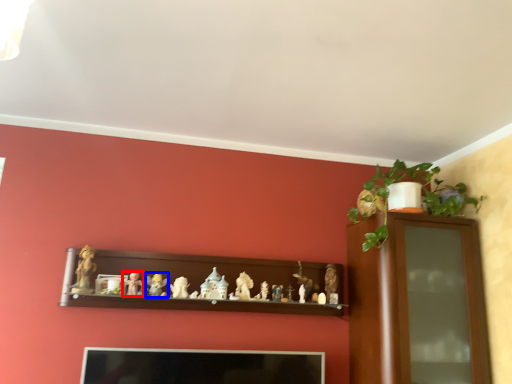
Question: Which of the following is the farthest to the observer, toy (highlighted by a red box) or toy (highlighted by a blue box)?

Choices:
 (A) toy
 (B) toy

Answer: (B)